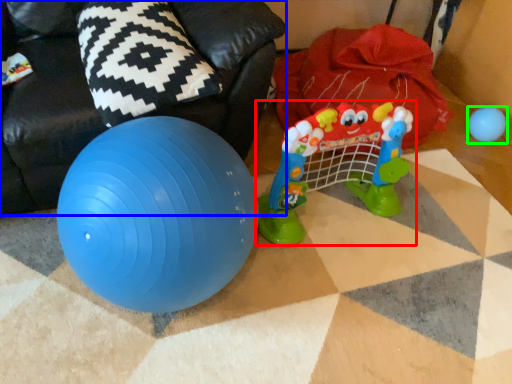
Question: Which object is the closest to the toy (highlighted by a red box)? Choose among these: bean bag chair (highlighted by a blue box) or toy (highlighted by a green box).

Choices:
 (A) bean bag chair
 (B) toy

Answer: (A)